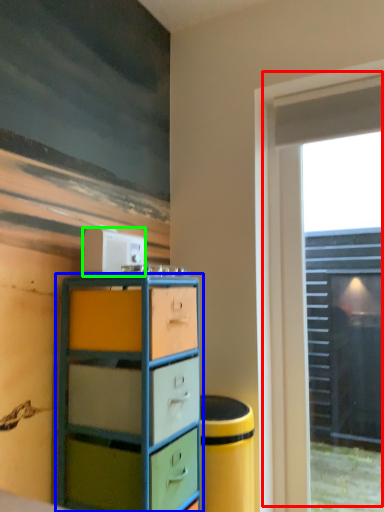
Question: Considering the real-world distances, which object is farthest from window (highlighted by a red box)? chest of drawers (highlighted by a blue box) or appliance (highlighted by a green box)?

Choices:
 (A) chest of drawers
 (B) appliance

Answer: (B)